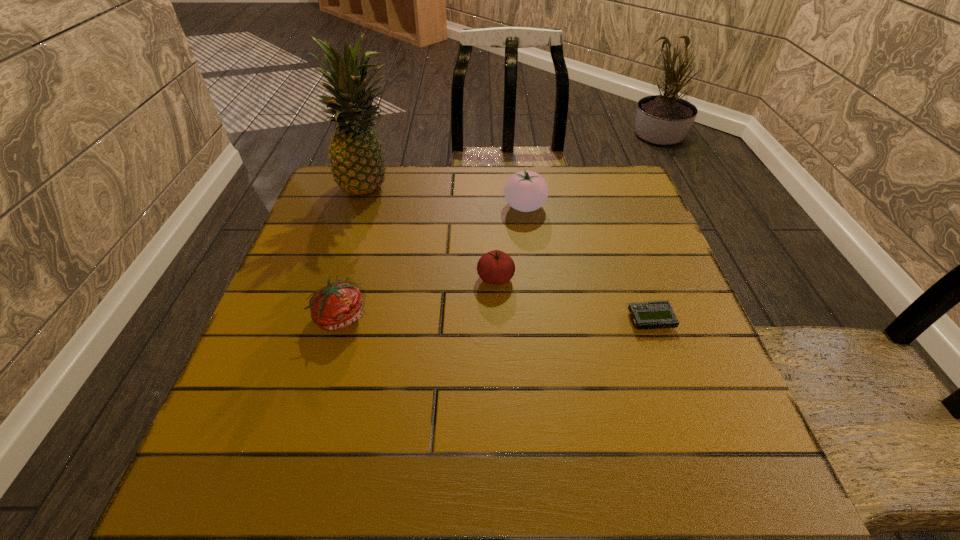
Identify the location of vacant region located on the right of the third farthest object. (550, 279).

Where is `free space located on the front of the rightmost object`? The height and width of the screenshot is (540, 960). free space located on the front of the rightmost object is located at coordinates (697, 451).

What are the coordinates of `pineapple that is at the far edge` in the screenshot? It's located at (x=357, y=164).

At what (x,y) coordinates should I click in order to perform the action: click on tomato that is at the far edge. Please return your answer as a coordinate pair (x, y). The image size is (960, 540). Looking at the image, I should click on (526, 191).

Find the location of a particular element. The height and width of the screenshot is (540, 960). pineapple present at the left edge is located at coordinates (357, 164).

You are a GUI agent. You are given a task and a screenshot of the screen. Output one action in this format:
    pyautogui.click(x=<x>, y=<y>)
    Task: Click on the tomato located at the left edge
    The image size is (960, 540).
    Given the screenshot: What is the action you would take?
    pyautogui.click(x=337, y=306)

This screenshot has height=540, width=960. I want to click on object that is positioned at the right edge, so click(x=658, y=314).

Where is `object that is positioned at the far left corner`? object that is positioned at the far left corner is located at coordinates (357, 164).

At what (x,y) coordinates should I click in order to perform the action: click on free region at the far edge of the desktop. Please return your answer as a coordinate pair (x, y). The image size is (960, 540). Looking at the image, I should click on (382, 205).

This screenshot has height=540, width=960. I want to click on vacant position at the near edge of the desktop, so click(x=332, y=459).